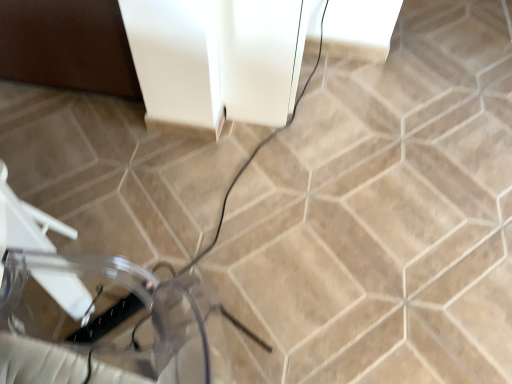
Identify the location of transparent plastic swivel chair at lower left. This screenshot has height=384, width=512. (137, 298).

What do you see at coordinates (137, 298) in the screenshot? Image resolution: width=512 pixels, height=384 pixels. I see `transparent plastic swivel chair at lower left` at bounding box center [137, 298].

Where is `transparent plastic swivel chair at lower left`? transparent plastic swivel chair at lower left is located at coordinates (137, 298).